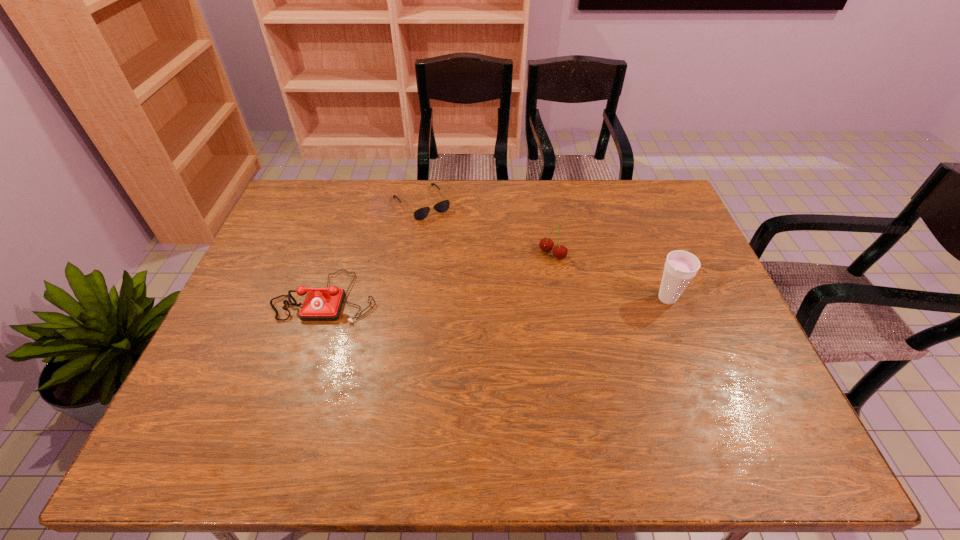
In order to click on free space on the desktop that is between the second shortest object and the rightmost object and is positioned on the front-facing side of the sunglasses in this screenshot , I will do `click(499, 298)`.

At what (x,y) coordinates should I click in order to perform the action: click on vacant spot on the desktop that is between the telephone and the rightmost object and is positioned on the surface of the second farthest object. Please return your answer as a coordinate pair (x, y). Looking at the image, I should click on (498, 298).